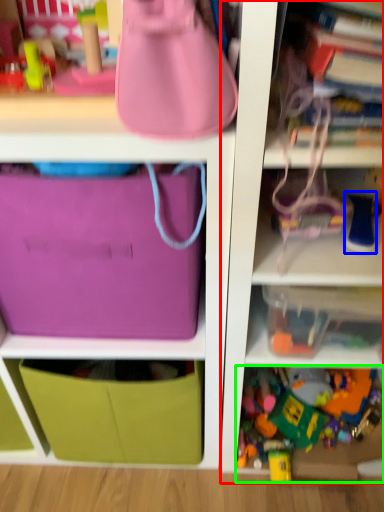
Question: Which object is positioned closest to shelf (highlighted by a red box)? Select from toy (highlighted by a blue box) and toy (highlighted by a green box).

Choices:
 (A) toy
 (B) toy

Answer: (B)